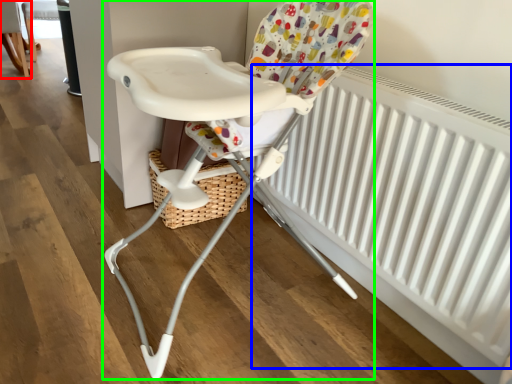
Question: Considering the real-world distances, which object is closest to chair (highlighted by a red box)? radiator (highlighted by a blue box) or chair (highlighted by a green box).

Choices:
 (A) radiator
 (B) chair

Answer: (B)